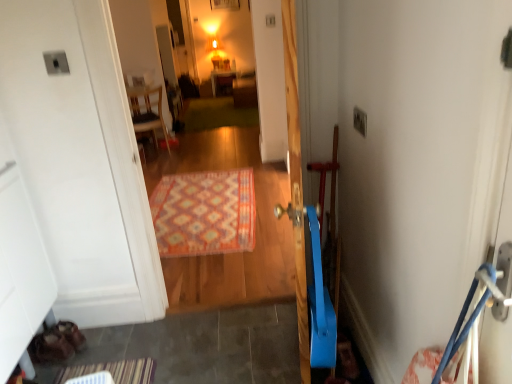
Question: Would you consider carpeted rug at center to be distant from matte wooden cabinet at center, acting as the second furniture starting from the bottom?

Choices:
 (A) no
 (B) yes

Answer: (B)

Question: Does carpeted rug at center have a greater height compared to matte wooden cabinet at center, which is counted as the first furniture, starting from the top?

Choices:
 (A) no
 (B) yes

Answer: (B)

Question: Could you tell me if carpeted rug at center is facing matte wooden cabinet at center, which is the 2th furniture from left to right?

Choices:
 (A) no
 (B) yes

Answer: (A)

Question: Is carpeted rug at center shorter than matte wooden cabinet at center, which is the 2th furniture from left to right?

Choices:
 (A) no
 (B) yes

Answer: (A)

Question: From the image's perspective, does carpeted rug at center appear higher than matte wooden cabinet at center, acting as the second furniture starting from the bottom?

Choices:
 (A) yes
 (B) no

Answer: (B)

Question: In terms of size, does wooden chair at upper left, arranged as the 1th furniture when viewed from the front, appear bigger or smaller than multicolored woven rug at center?

Choices:
 (A) big
 (B) small

Answer: (A)

Question: Do you think wooden chair at upper left, which ranks as the 1th furniture in left-to-right order, is within multicolored woven rug at center, or outside of it?

Choices:
 (A) outside
 (B) inside

Answer: (A)

Question: Considering the positions of wooden chair at upper left, the 2th furniture positioned from the top, and multicolored woven rug at center in the image, is wooden chair at upper left, the 2th furniture positioned from the top, wider or thinner than multicolored woven rug at center?

Choices:
 (A) wide
 (B) thin

Answer: (B)

Question: From the image's perspective, is wooden chair at upper left, which ranks as the 1th furniture in left-to-right order, positioned above or below multicolored woven rug at center?

Choices:
 (A) below
 (B) above

Answer: (B)

Question: Is point (221, 91) positioned closer to the camera than point (181, 205)?

Choices:
 (A) closer
 (B) farther

Answer: (B)

Question: Considering the positions of matte wooden cabinet at center, which is counted as the 1th furniture, starting from the back, and multicolored woven rug at center in the image, is matte wooden cabinet at center, which is counted as the 1th furniture, starting from the back, wider or thinner than multicolored woven rug at center?

Choices:
 (A) thin
 (B) wide

Answer: (A)

Question: Relative to multicolored woven rug at center, is matte wooden cabinet at center, which is counted as the first furniture, starting from the top, in front or behind?

Choices:
 (A) behind
 (B) front

Answer: (A)

Question: From the image's perspective, is matte wooden cabinet at center, which is counted as the 1th furniture, starting from the back, above or below multicolored woven rug at center?

Choices:
 (A) below
 (B) above

Answer: (B)

Question: Looking at their shapes, would you say multicolored woven rug at center is wider or thinner than matte wooden cabinet at center, acting as the second furniture starting from the bottom?

Choices:
 (A) wide
 (B) thin

Answer: (A)

Question: In terms of height, does multicolored woven rug at center look taller or shorter compared to matte wooden cabinet at center, which is counted as the first furniture, starting from the top?

Choices:
 (A) short
 (B) tall

Answer: (A)